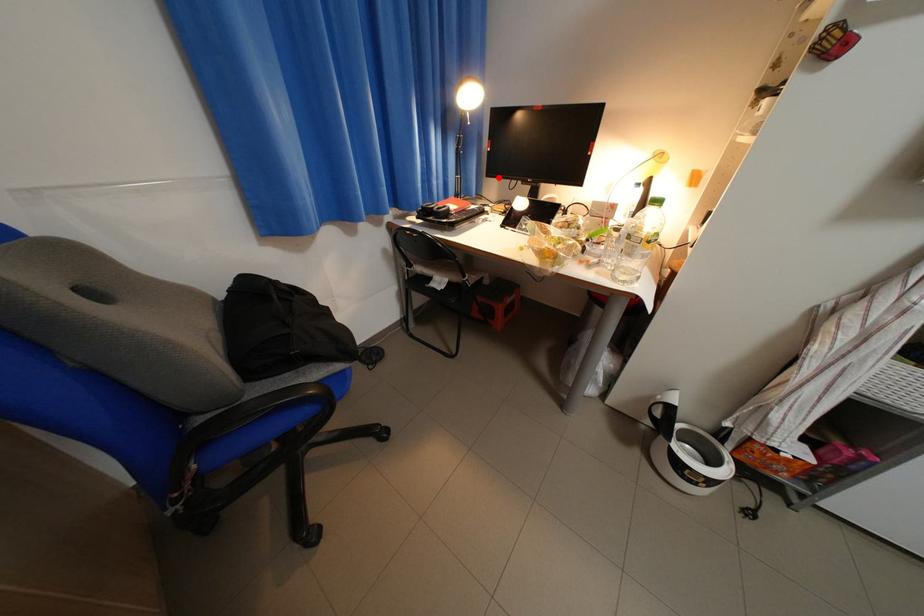
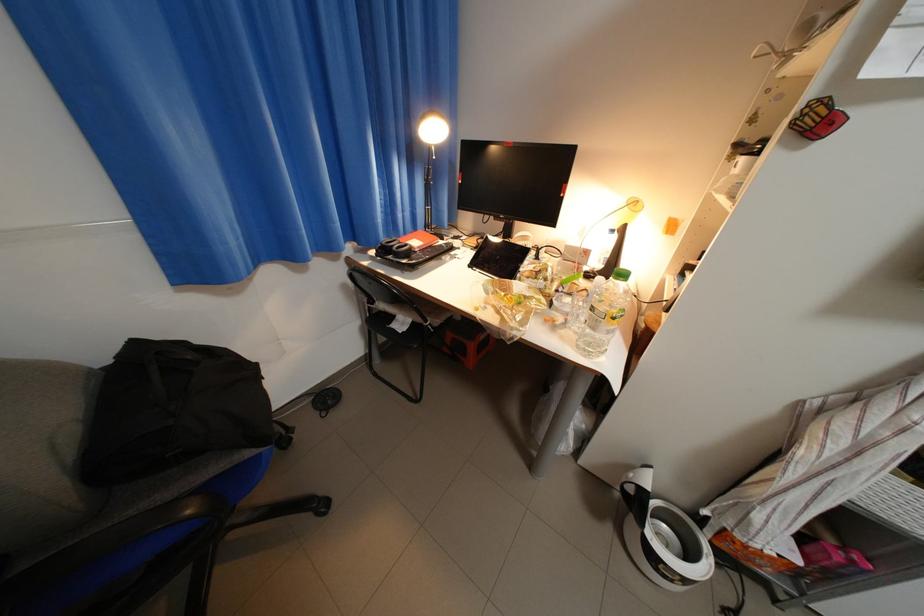
In the second image, find the point that corresponds to the highlighted location in the first image.

(469, 209)